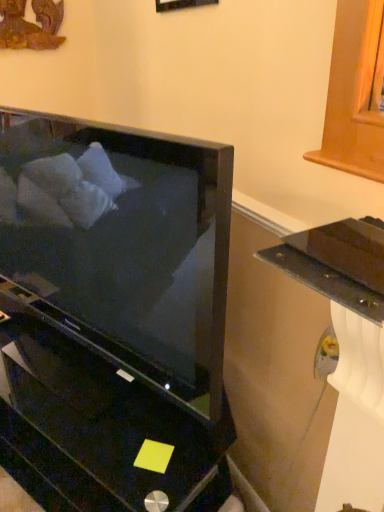
Question: Relative to satin black tv at center, is wooden picture frame at upper center in front or behind?

Choices:
 (A) front
 (B) behind

Answer: (B)

Question: Considering the positions of wooden picture frame at upper center and satin black tv at center in the image, is wooden picture frame at upper center bigger or smaller than satin black tv at center?

Choices:
 (A) big
 (B) small

Answer: (B)

Question: Is wooden picture frame at upper center situated inside satin black tv at center or outside?

Choices:
 (A) outside
 (B) inside

Answer: (A)

Question: Visually, is satin black tv at center positioned to the left or to the right of wooden picture frame at upper center?

Choices:
 (A) right
 (B) left

Answer: (B)

Question: Considering the positions of point (125, 470) and point (157, 9), is point (125, 470) closer or farther from the camera than point (157, 9)?

Choices:
 (A) closer
 (B) farther

Answer: (A)

Question: From the image's perspective, is satin black tv at center located above or below wooden picture frame at upper center?

Choices:
 (A) below
 (B) above

Answer: (A)

Question: From a real-world perspective, is satin black tv at center above or below wooden picture frame at upper center?

Choices:
 (A) below
 (B) above

Answer: (A)